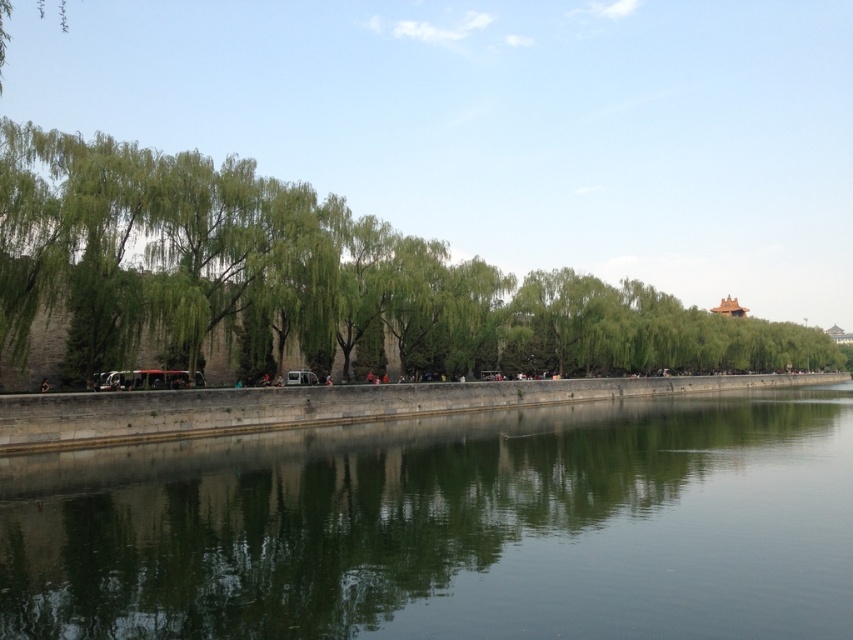
You are standing at the riverside and see the green stone wall at lower center and the green leafy tree at left. Which object is positioned to the left of the other?

A: The green stone wall at lower center is to the left of the green leafy tree at left.

You are a painter setting up an easel to capture this riverside scene. You want to ensure your painting accurately represents the relative sizes of the green stone wall at lower center and the green leafy tree at left. Based on the scene, which object should you depict as wider in your painting?

The green leafy tree at left should be depicted as wider in the painting since the green stone wall at lower center is narrower than it.